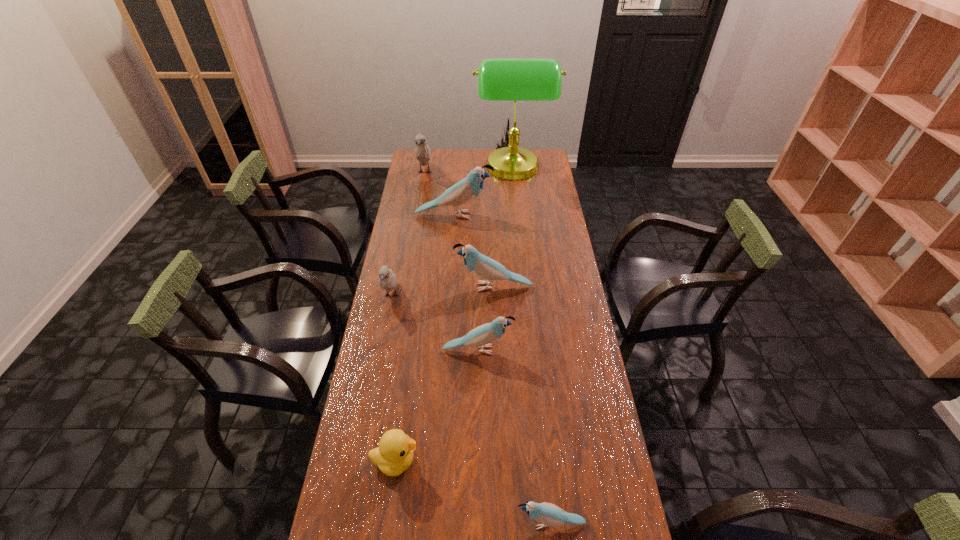
You are a GUI agent. You are given a task and a screenshot of the screen. Output one action in this format:
    pyautogui.click(x=<x>, y=<y>)
    Task: Click on the duck
    This screenshot has height=540, width=960.
    Given the screenshot: What is the action you would take?
    pyautogui.click(x=394, y=455)

Find the location of `yellow duck`. yellow duck is located at coordinates click(x=394, y=455).

Identify the location of the shortest bird. (547, 514).

I want to click on the smallest blue bird, so click(x=547, y=514).

At what (x,y) coordinates should I click in order to perform the action: click on vacant space situated on the desk next to the green lamp. Please return your answer as a coordinate pair (x, y). Looking at the image, I should click on (422, 170).

Find the location of a particular element. This screenshot has height=540, width=960. free space located 0.120m on the desk next to the green lamp is located at coordinates (451, 170).

Identify the location of vacant space located on the desk next to the green lamp. (424, 170).

Where is `free region located 0.150m at the face of the farthest blue bird`? free region located 0.150m at the face of the farthest blue bird is located at coordinates (525, 215).

Where is `vacant area situated at the beak of the farthest bird`? This screenshot has width=960, height=540. vacant area situated at the beak of the farthest bird is located at coordinates (416, 228).

Identify the location of vacant space located at the face of the third nearest blue bird. The width and height of the screenshot is (960, 540). (404, 287).